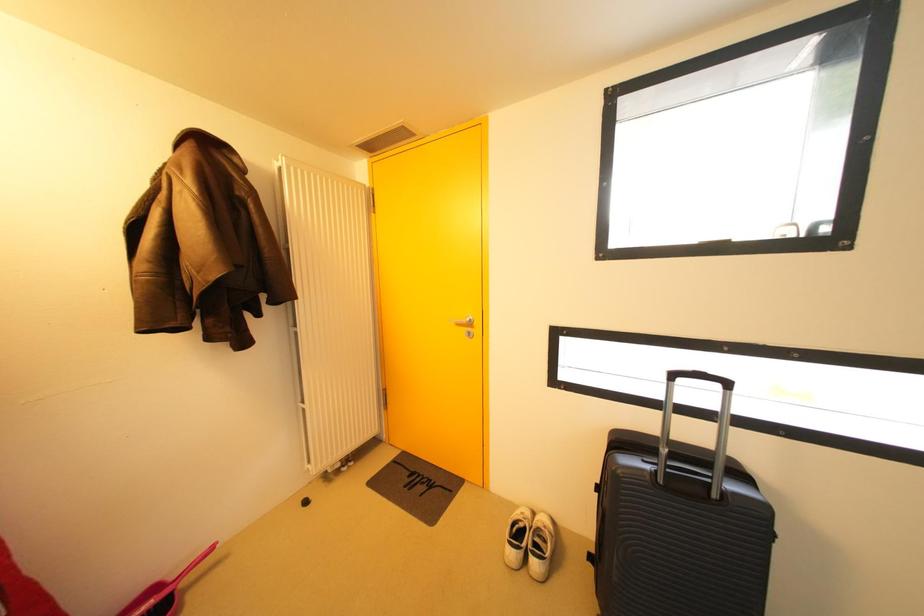
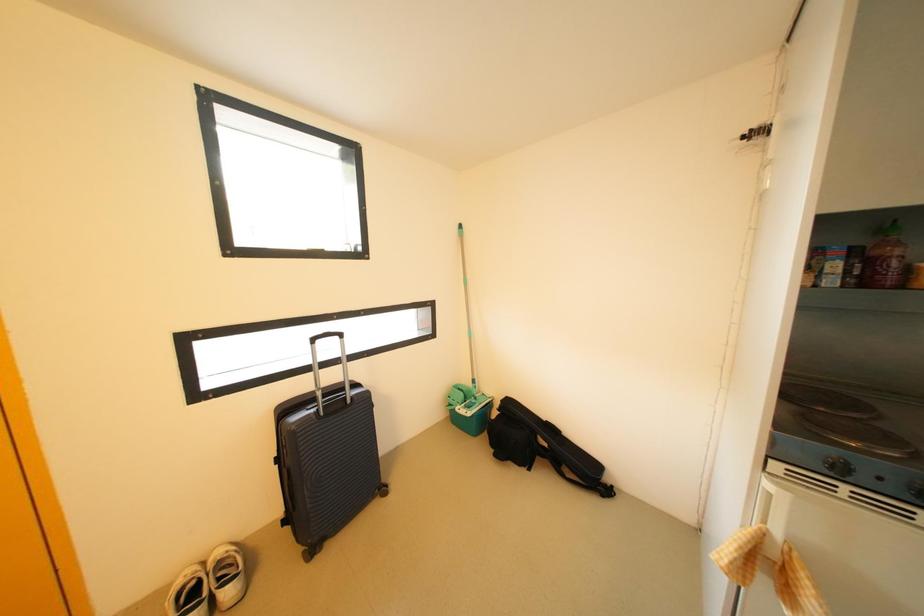
Question: The camera is either moving clockwise (left) or counter-clockwise (right) around the object. The first image is from the beginning of the video and the second image is from the end. Is the camera moving left or right when shooting the video?

Choices:
 (A) Left
 (B) Right

Answer: (A)